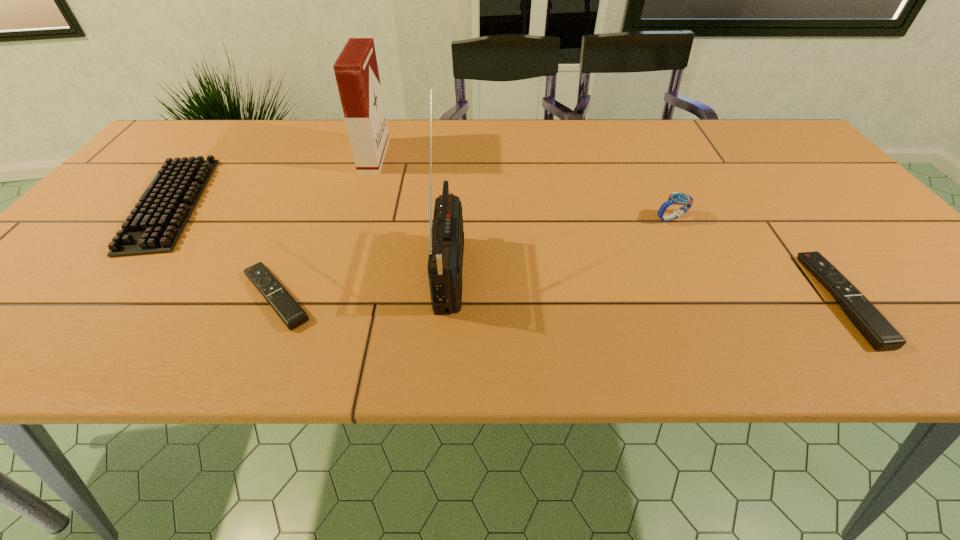
Locate an element on the screen. The image size is (960, 540). the shortest object is located at coordinates (285, 306).

The height and width of the screenshot is (540, 960). I want to click on the shorter remote control, so click(x=285, y=306).

Locate an element on the screen. the rightmost object is located at coordinates (877, 330).

Find the location of a particular element. This screenshot has height=540, width=960. the right remote control is located at coordinates (877, 330).

The height and width of the screenshot is (540, 960). Identify the location of cigarette_case. (356, 70).

I want to click on watch, so click(677, 198).

Identify the location of the fourth shortest object. Image resolution: width=960 pixels, height=540 pixels. (677, 198).

Locate an element on the screen. Image resolution: width=960 pixels, height=540 pixels. the leftmost object is located at coordinates (157, 221).

This screenshot has width=960, height=540. I want to click on the third object from right to left, so click(446, 236).

Find the location of `vacant area situated on the right of the shortest object`. vacant area situated on the right of the shortest object is located at coordinates (426, 296).